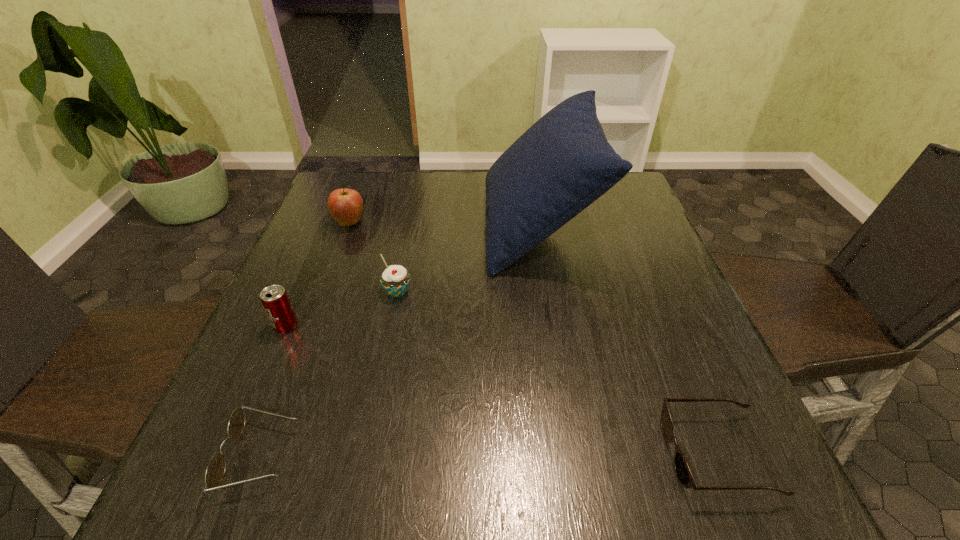
Find the location of a particular element. vacant space located 0.210m on the facing side of the second object from right to left is located at coordinates (404, 227).

Find the location of a particular element. vacant space situated on the right of the apple is located at coordinates (480, 222).

You are a GUI agent. You are given a task and a screenshot of the screen. Output one action in this format:
    pyautogui.click(x=<x>, y=<y>)
    Task: Click on the free region located on the back of the beer can
    
    Given the screenshot: What is the action you would take?
    pyautogui.click(x=330, y=225)

The image size is (960, 540). In order to click on free space located on the front of the third object from right to left in this screenshot , I will do `click(371, 427)`.

At what (x,y) coordinates should I click in order to perform the action: click on free spot located 0.180m on the front-facing side of the spectacles. Please return your answer as a coordinate pair (x, y). This screenshot has height=540, width=960. Looking at the image, I should click on (407, 455).

Where is `free space located on the front lenses of the rightmost object`? free space located on the front lenses of the rightmost object is located at coordinates (636, 454).

Where is `vacant region located 0.360m on the front lenses of the rightmost object`? vacant region located 0.360m on the front lenses of the rightmost object is located at coordinates (441, 454).

Image resolution: width=960 pixels, height=540 pixels. Find the location of `free location located on the front lenses of the rightmost object`. free location located on the front lenses of the rightmost object is located at coordinates point(529,454).

You are a GUI agent. You are given a task and a screenshot of the screen. Output one action in this format:
    pyautogui.click(x=<x>, y=<y>)
    Task: Click on the cushion that is at the far edge
    The width and height of the screenshot is (960, 540).
    Given the screenshot: What is the action you would take?
    pyautogui.click(x=563, y=163)

This screenshot has width=960, height=540. Find the location of `apple located at the far edge`. apple located at the far edge is located at coordinates (345, 205).